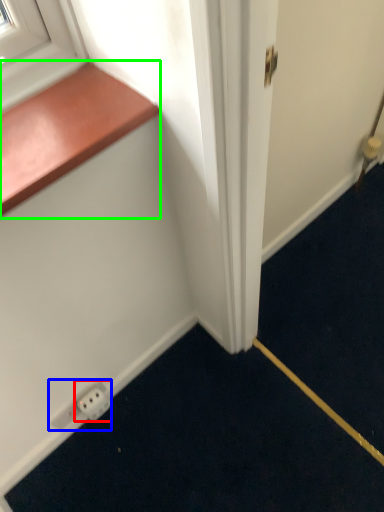
Question: Estimate the real-world distances between objects in this image. Which object is farther from electric outlet (highlighted by a red box), electric outlet (highlighted by a blue box) or window sill (highlighted by a green box)?

Choices:
 (A) electric outlet
 (B) window sill

Answer: (B)